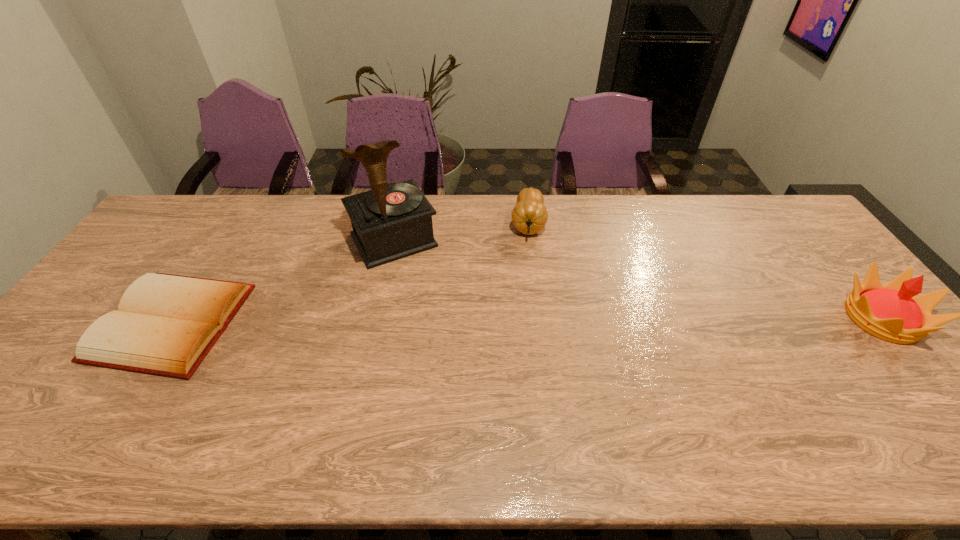
The image size is (960, 540). I want to click on vacant space on the desktop that is between the shortest object and the second tallest object and is positioned at the horn opening of the third object from right to left, so click(x=441, y=321).

Find the location of a particular element. Image resolution: width=960 pixels, height=540 pixels. free spot on the desktop that is between the leftmost object and the third shortest object and is positioned on the stem side of the gourd is located at coordinates (522, 320).